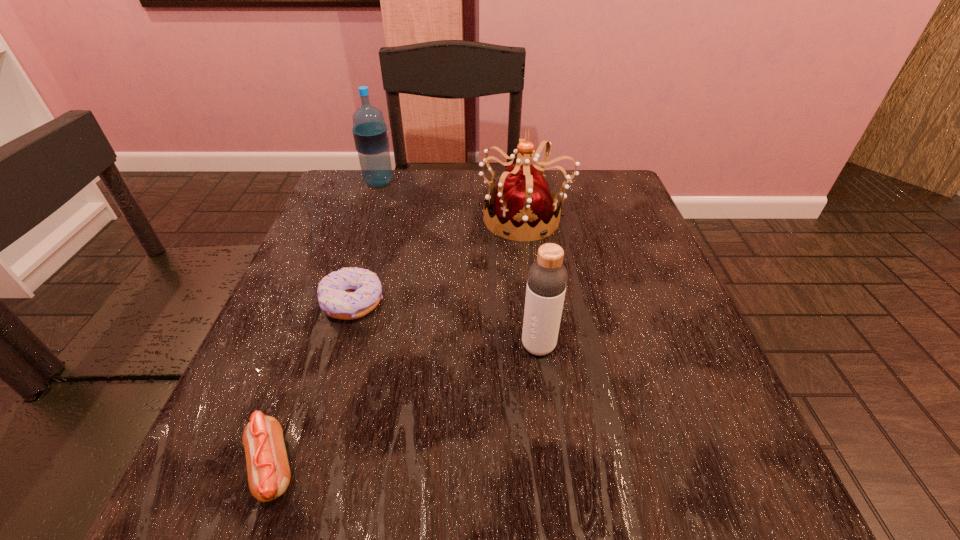
This screenshot has width=960, height=540. In order to click on unoccupied area between the bottle and the nearest object in this screenshot , I will do `click(405, 407)`.

Locate an element on the screen. This screenshot has width=960, height=540. vacant space in between the sausage and the doughnut is located at coordinates (x=312, y=385).

Locate an element on the screen. This screenshot has height=540, width=960. free space between the tiara and the water bottle is located at coordinates (452, 200).

I want to click on free area in between the water bottle and the bottle, so click(x=459, y=264).

Image resolution: width=960 pixels, height=540 pixels. I want to click on free space between the third nearest object and the tiara, so click(439, 260).

This screenshot has height=540, width=960. I want to click on vacant area that lies between the third nearest object and the farthest object, so click(366, 242).

Locate which object ranks fourth in proximity to the doughnut. Please provide its 2D coordinates. Your answer should be formatted as a tuple, i.e. [(x, y)], where the tuple contains the x and y coordinates of a point satisfying the conditions above.

[(370, 132)]

Identify which object is located as the second nearest to the sausage. Please provide its 2D coordinates. Your answer should be formatted as a tuple, i.e. [(x, y)], where the tuple contains the x and y coordinates of a point satisfying the conditions above.

[(547, 278)]